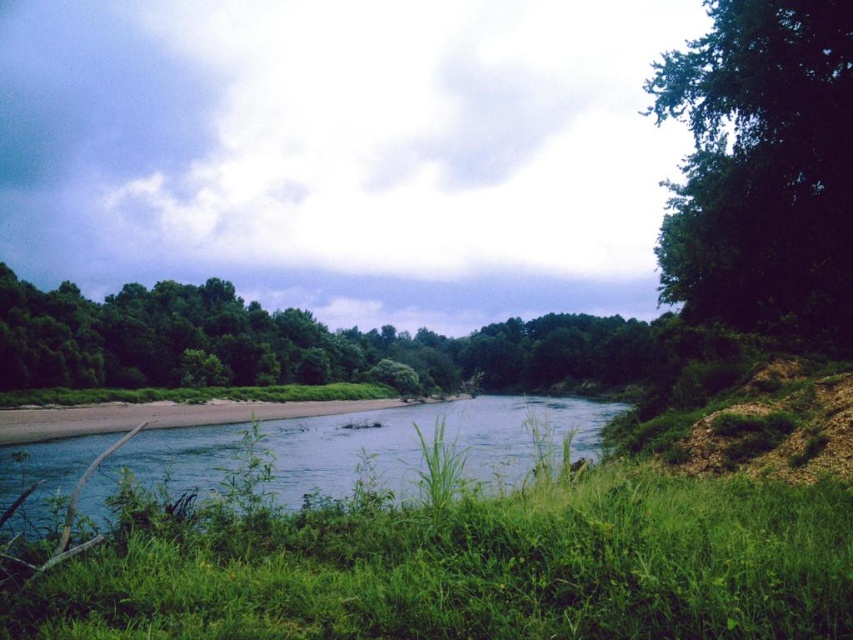
Question: Is green grass at lower center further to the viewer compared to brown sandy shore at lower left?

Choices:
 (A) yes
 (B) no

Answer: (B)

Question: Is green leafy tree at upper right below brown sandy shore at lower left?

Choices:
 (A) no
 (B) yes

Answer: (A)

Question: Among these objects, which one is nearest to the camera?

Choices:
 (A) green leafy trees at center
 (B) brown sandy shore at lower left
 (C) green grass at lower center

Answer: (C)

Question: Is green grass at lower center above green leafy tree at upper right?

Choices:
 (A) no
 (B) yes

Answer: (A)

Question: Among these points, which one is farthest from the camera?

Choices:
 (A) (212, 301)
 (B) (122, 417)
 (C) (102, 436)

Answer: (A)

Question: Which point is closer to the camera?

Choices:
 (A) (268, 360)
 (B) (15, 424)
 (C) (703, 522)

Answer: (C)